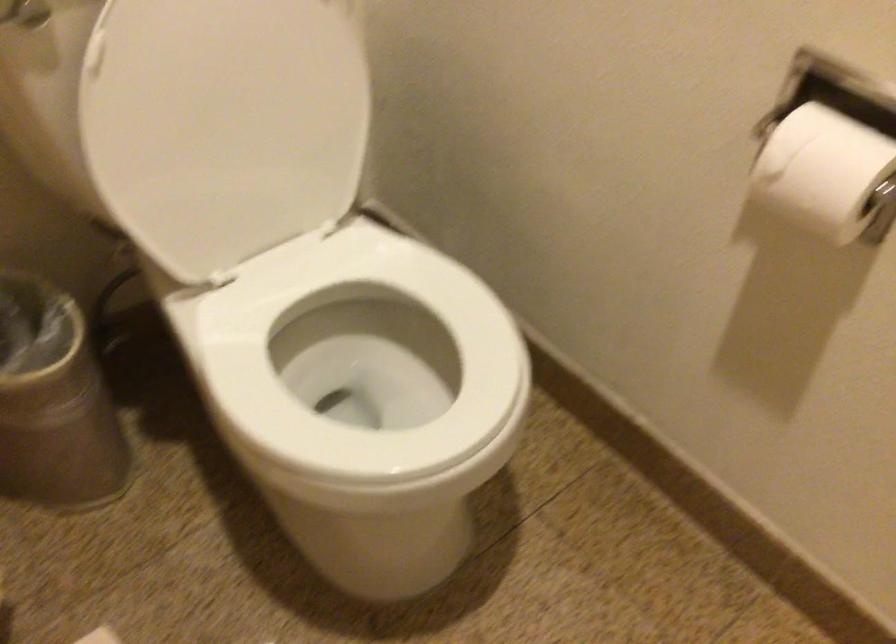
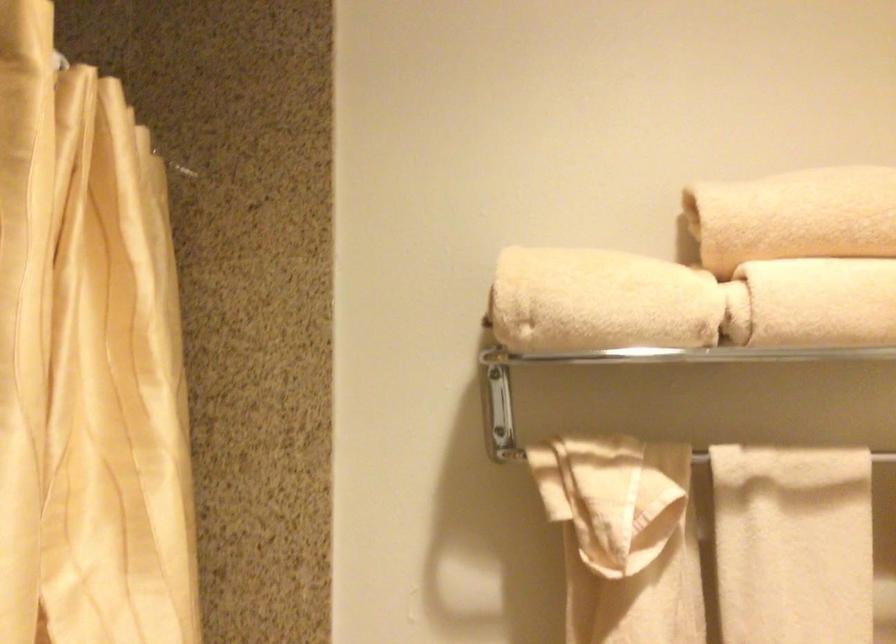
The first image is from the beginning of the video and the second image is from the end. How did the camera likely rotate when shooting the video?

The camera's rotation is toward left-up.